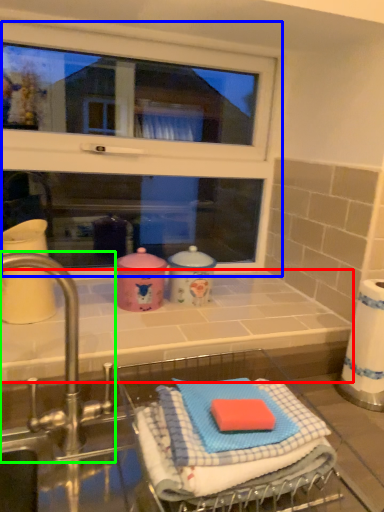
Question: Which object is the closest to the counter top (highlighted by a red box)? Choose among these: window (highlighted by a blue box) or tap (highlighted by a green box).

Choices:
 (A) window
 (B) tap

Answer: (B)